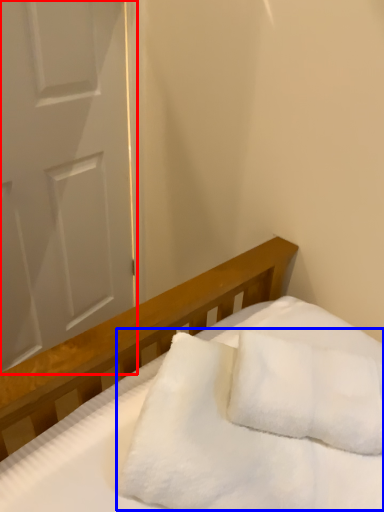
Question: Which point is further to the camera, door (highlighted by a red box) or blanket (highlighted by a blue box)?

Choices:
 (A) door
 (B) blanket

Answer: (A)